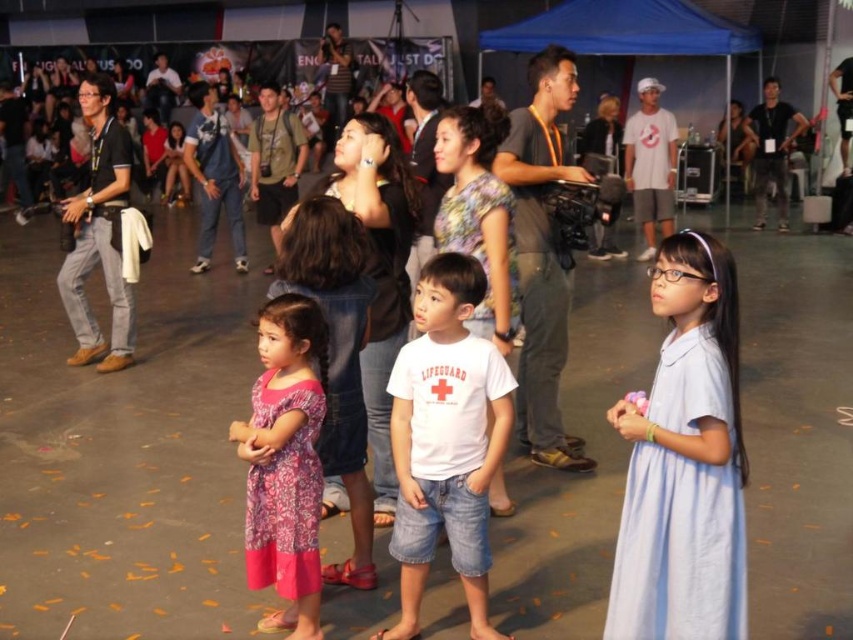
Question: Can you confirm if light blue fabric dress at center is positioned below white cotton t-shirt at center?

Choices:
 (A) yes
 (B) no

Answer: (B)

Question: Which point is closer to the camera?

Choices:
 (A) (689, 525)
 (B) (289, 552)
 (C) (403, 588)

Answer: (A)

Question: Observing the image, what is the correct spatial positioning of light blue fabric dress at center in reference to white cotton t-shirt at center?

Choices:
 (A) right
 (B) left

Answer: (A)

Question: Which point is closer to the camera?

Choices:
 (A) pink floral dress at center
 (B) white cotton t-shirt at center

Answer: (A)

Question: Does light blue fabric dress at center lie in front of pink floral dress at center?

Choices:
 (A) yes
 (B) no

Answer: (A)

Question: Which of these objects is positioned closest to the pink floral dress at center?

Choices:
 (A) white cotton t-shirt at center
 (B) light blue fabric dress at center

Answer: (A)